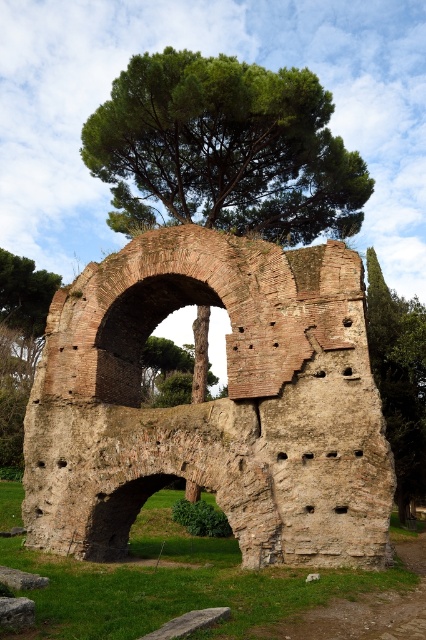
You are an architect assessing the structural integrity of the brick stone arch at center and the green leafy tree at upper center. Which object has a smaller width according to the scene?

The brick stone arch at center has a smaller width than the green leafy tree at upper center.

Where is the brick stone arch at center located in the image?

The brick stone arch at center is located at point (213, 403).

You are a bird flying over the ancient stone structure. You want to land on the highest point between the brick stone arch at center and the green leafy tree at upper center. Which one should you choose?

The brick stone arch at center is taller than the green leafy tree at upper center, so you should land on the brick stone arch at center to reach the highest point.